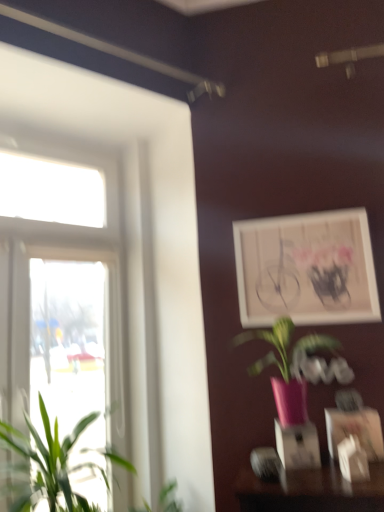
Question: Is the position of white matte picture frame at upper right, the 1th picture frame in the back-to-front sequence, more distant than that of clear glass window at left?

Choices:
 (A) yes
 (B) no

Answer: (A)

Question: From the image's perspective, is white matte picture frame at upper right, which is the 2th picture frame in front-to-back order, located above clear glass window at left?

Choices:
 (A) yes
 (B) no

Answer: (A)

Question: Is white matte picture frame at upper right, the second picture frame positioned from the bottom, positioned far away from clear glass window at left?

Choices:
 (A) no
 (B) yes

Answer: (A)

Question: Does white matte picture frame at upper right, the second picture frame positioned from the bottom, have a smaller size compared to clear glass window at left?

Choices:
 (A) yes
 (B) no

Answer: (A)

Question: Is white matte picture frame at upper right, the first picture frame positioned from the top, at the right side of clear glass window at left?

Choices:
 (A) no
 (B) yes

Answer: (B)

Question: From the image's perspective, would you say white matte picture frame at upper right, the second picture frame positioned from the bottom, is shown under clear glass window at left?

Choices:
 (A) yes
 (B) no

Answer: (B)

Question: From a real-world perspective, is white matte picture frame at upper right, the first picture frame positioned from the top, positioned under green leafy plant at left, the 2th houseplant in the right-to-left sequence, based on gravity?

Choices:
 (A) yes
 (B) no

Answer: (B)

Question: Is white matte picture frame at upper right, the first picture frame positioned from the top, located outside green leafy plant at left, the 2th houseplant in the right-to-left sequence?

Choices:
 (A) yes
 (B) no

Answer: (A)

Question: Is white matte picture frame at upper right, the 1th picture frame in the back-to-front sequence, positioned far away from green leafy plant at left, the 1th houseplant viewed from the left?

Choices:
 (A) no
 (B) yes

Answer: (B)

Question: Is white matte picture frame at upper right, which is the 2th picture frame in front-to-back order, smaller than green leafy plant at left, the 2th houseplant in the right-to-left sequence?

Choices:
 (A) yes
 (B) no

Answer: (A)

Question: Is white matte picture frame at upper right, the second picture frame positioned from the bottom, at the left side of green leafy plant at left, the 1th houseplant viewed from the left?

Choices:
 (A) yes
 (B) no

Answer: (B)

Question: Could green leafy plant at left, the 2th houseplant in the right-to-left sequence, be considered to be inside white matte picture frame at upper right, the first picture frame positioned from the top?

Choices:
 (A) no
 (B) yes

Answer: (A)

Question: From the image's perspective, is white matte picture frame at upper right, which is the 2th picture frame in front-to-back order, over pink matte vase at center, marked as the 2th houseplant in a left-to-right arrangement?

Choices:
 (A) no
 (B) yes

Answer: (B)